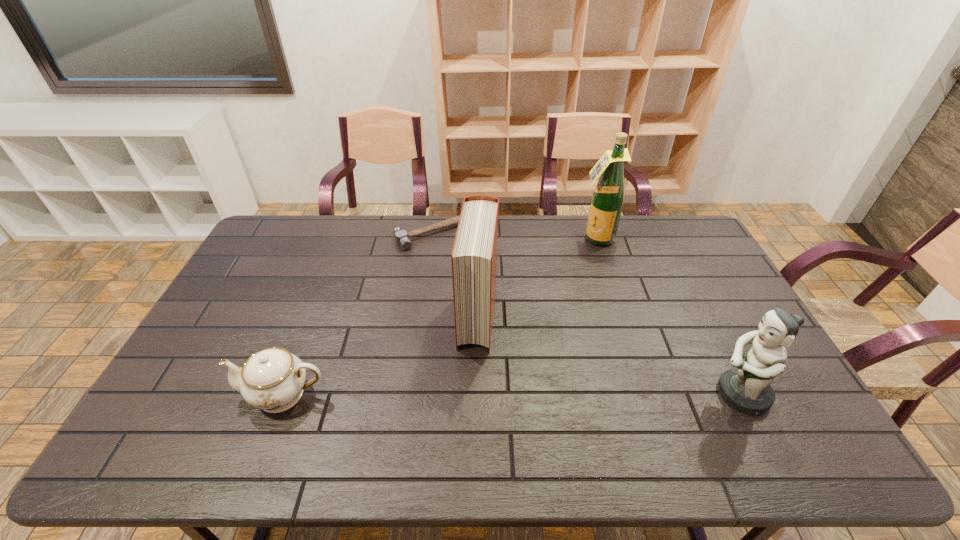
This screenshot has height=540, width=960. In order to click on vacant area at the near edge in this screenshot , I will do `click(467, 396)`.

You are a GUI agent. You are given a task and a screenshot of the screen. Output one action in this format:
    pyautogui.click(x=<x>, y=<y>)
    Task: Click on the vacant area at the left edge of the desktop
    
    Given the screenshot: What is the action you would take?
    pyautogui.click(x=252, y=306)

Identify the location of free region at the right edge of the desktop. (719, 269).

In the image, there is a desktop. Identify the location of vacant space at the near left corner. (159, 409).

Find the location of `vacant region between the fourth tallest object and the third shortest object`. vacant region between the fourth tallest object and the third shortest object is located at coordinates (512, 394).

At what (x,y) coordinates should I click in order to perform the action: click on free space between the second shortest object and the fourth shortest object. Please return your answer as a coordinate pair (x, y). The height and width of the screenshot is (540, 960). Looking at the image, I should click on (380, 356).

I want to click on free space that is in between the chinaware and the liquor, so click(x=440, y=316).

Find the location of `vacant point located between the shortest object and the fourth tallest object`. vacant point located between the shortest object and the fourth tallest object is located at coordinates (360, 314).

You are a GUI agent. You are given a task and a screenshot of the screen. Output one action in this format:
    pyautogui.click(x=<x>, y=<y>)
    Task: Click on the free space between the liquor and the leftmost object
    This screenshot has height=540, width=960.
    Given the screenshot: What is the action you would take?
    (440, 316)

What are the coordinates of `free space between the third tallest object and the hardback book` in the screenshot? It's located at (609, 356).